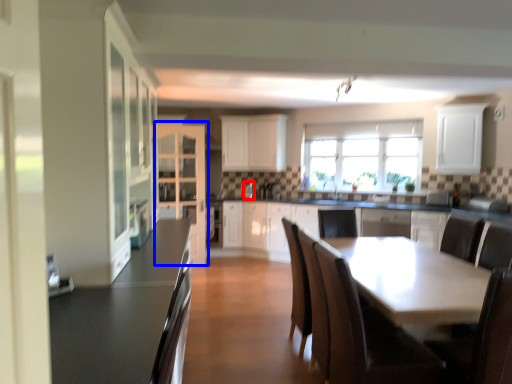
Question: Which point is closer to the camera, appliance (highlighted by a red box) or cabinetry (highlighted by a blue box)?

Choices:
 (A) appliance
 (B) cabinetry

Answer: (B)